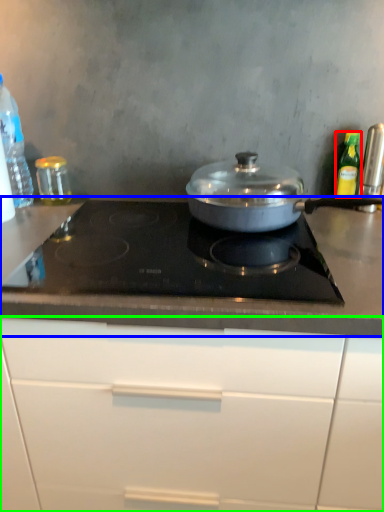
Question: Which object is the closest to the kitchen appliance (highlighted by a red box)? Choose among these: countertop (highlighted by a blue box) or cabinetry (highlighted by a green box).

Choices:
 (A) countertop
 (B) cabinetry

Answer: (A)